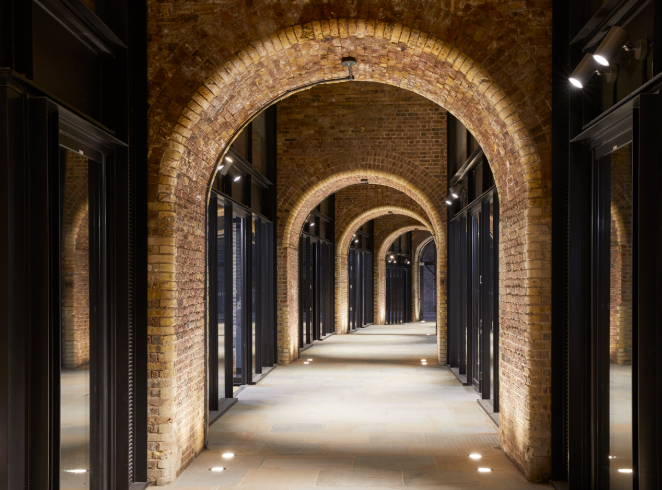
Identify the location of lights. (226, 159), (239, 178), (447, 201), (455, 195).